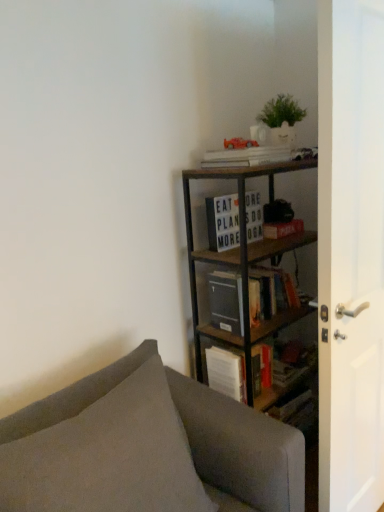
Describe the element at coordinates (352, 251) in the screenshot. I see `white glossy door at right` at that location.

Where is `white matte book at upper center, positioned as the 1th book in top-to-bottom order`? The width and height of the screenshot is (384, 512). white matte book at upper center, positioned as the 1th book in top-to-bottom order is located at coordinates (247, 156).

Is metallic brown bookcase at upper right located within white matte book at upper center, the 3th book when ordered from bottom to top?

That's incorrect, metallic brown bookcase at upper right is not inside white matte book at upper center, the 3th book when ordered from bottom to top.

From the image's perspective, does white matte book at upper center, positioned as the 1th book in top-to-bottom order, appear higher than metallic brown bookcase at upper right?

Yes, from the image's perspective, white matte book at upper center, positioned as the 1th book in top-to-bottom order, is above metallic brown bookcase at upper right.

Between white matte book at upper center, the 3th book when ordered from bottom to top, and metallic brown bookcase at upper right, which one appears on the right side from the viewer's perspective?

From the viewer's perspective, metallic brown bookcase at upper right appears more on the right side.

How distant is white matte book at upper center, positioned as the 1th book in top-to-bottom order, from metallic brown bookcase at upper right?

Result: white matte book at upper center, positioned as the 1th book in top-to-bottom order, and metallic brown bookcase at upper right are 13.87 inches apart.

Considering the positions of objects white matte paperback book at upper center and white matte signboard at upper center, the second book in the bottom-to-top sequence, in the image provided, who is more to the left, white matte paperback book at upper center or white matte signboard at upper center, the second book in the bottom-to-top sequence,?

Positioned to the left is white matte signboard at upper center, the second book in the bottom-to-top sequence.

Is white matte paperback book at upper center spatially inside white matte signboard at upper center, the second book in the bottom-to-top sequence, or outside of it?

white matte paperback book at upper center is not enclosed by white matte signboard at upper center, the second book in the bottom-to-top sequence.

Is white matte paperback book at upper center placed right next to white matte signboard at upper center, placed as the second book when sorted from top to bottom?

No, white matte paperback book at upper center is not next to white matte signboard at upper center, placed as the second book when sorted from top to bottom.

How much distance is there between white matte paperback book at upper center and white matte signboard at upper center, placed as the second book when sorted from top to bottom?

The distance of white matte paperback book at upper center from white matte signboard at upper center, placed as the second book when sorted from top to bottom, is 5.78 inches.

Which object is further away from the camera, white glossy door at right or metallic brown bookcase at upper right?

metallic brown bookcase at upper right.

Looking at this image, from a real-world perspective, relative to metallic brown bookcase at upper right, is white glossy door at right vertically above or below?

In terms of real-world spatial position, white glossy door at right is above metallic brown bookcase at upper right.

Based on the photo, is white glossy door at right bigger than metallic brown bookcase at upper right?

No, white glossy door at right is not bigger than metallic brown bookcase at upper right.

Which of these two, white matte signboard at upper center, the second book in the bottom-to-top sequence, or white matte paperback book at upper center, is smaller?

white matte paperback book at upper center.

Is there a large distance between white matte signboard at upper center, the second book in the bottom-to-top sequence, and white matte paperback book at upper center?

No, white matte signboard at upper center, the second book in the bottom-to-top sequence, is in close proximity to white matte paperback book at upper center.

Is white matte signboard at upper center, placed as the second book when sorted from top to bottom, oriented away from white matte paperback book at upper center?

No, white matte paperback book at upper center is not at the back of white matte signboard at upper center, placed as the second book when sorted from top to bottom.

Looking at their sizes, would you say white matte signboard at upper center, the second book in the bottom-to-top sequence, is wider or thinner than white matte paperback book at upper center?

In the image, white matte signboard at upper center, the second book in the bottom-to-top sequence, appears to be more narrow than white matte paperback book at upper center.

Looking at this image, from the image's perspective, which is below, white matte paperback book at upper center or white glossy door at right?

white glossy door at right.

From a real-world perspective, is white matte paperback book at upper center positioned under white glossy door at right based on gravity?

Incorrect, from a real-world perspective, white matte paperback book at upper center is higher than white glossy door at right.

Which point is more distant from viewer, [286,222] or [333,11]?

The point [286,222] is farther from the camera.

Could you tell me if white matte paperback book at upper center is facing white glossy door at right?

Yes, white matte paperback book at upper center is facing white glossy door at right.

From the image's perspective, is metallic brown bookcase at upper right on white glossy door at right?

No, from the image's perspective, metallic brown bookcase at upper right is not over white glossy door at right.

Would you say metallic brown bookcase at upper right is a long distance from white glossy door at right?

No, metallic brown bookcase at upper right is in close proximity to white glossy door at right.

How many degrees apart are the facing directions of metallic brown bookcase at upper right and white glossy door at right?

2.07 degrees separate the facing orientations of metallic brown bookcase at upper right and white glossy door at right.

Looking at this image, does metallic brown bookcase at upper right come in front of white glossy door at right?

No.

From the image's perspective, between white matte book at upper center, the 3th book when ordered from bottom to top, and white glossy door at right, who is located below?

white glossy door at right.

Considering the relative positions of white matte book at upper center, positioned as the 1th book in top-to-bottom order, and white glossy door at right in the image provided, is white matte book at upper center, positioned as the 1th book in top-to-bottom order, to the right of white glossy door at right from the viewer's perspective?

In fact, white matte book at upper center, positioned as the 1th book in top-to-bottom order, is to the left of white glossy door at right.

Which is nearer, (254, 161) or (369, 260)?

Point (254, 161) is farther from the camera than point (369, 260).

Is white matte book at upper center, the 3th book when ordered from bottom to top, in front of or behind white glossy door at right in the image?

In the image, white matte book at upper center, the 3th book when ordered from bottom to top, appears behind white glossy door at right.

This screenshot has width=384, height=512. In order to click on the 1st book behind the metallic brown bookcase at upper right in this screenshot , I will do `click(247, 156)`.

Where is `paperback book below the white matte signboard at upper center, placed as the second book when sorted from top to bottom (from a real-world perspective)`? Image resolution: width=384 pixels, height=512 pixels. paperback book below the white matte signboard at upper center, placed as the second book when sorted from top to bottom (from a real-world perspective) is located at coordinates (282, 229).

Based on their spatial positions, is matte black book at center, the third book when ordered from top to bottom, or white glossy door at right closer to gray fabric couch at lower left?

white glossy door at right is positioned closer to the anchor gray fabric couch at lower left.

Which object lies nearer to the anchor point white matte signboard at upper center, placed as the second book when sorted from top to bottom, matte black book at center, the third book when ordered from top to bottom, or metallic brown bookcase at upper right?

Based on the image, metallic brown bookcase at upper right appears to be nearer to white matte signboard at upper center, placed as the second book when sorted from top to bottom.

Looking at the image, which one is located further to metallic brown bookcase at upper right, matte black book at center, positioned as the 1th book in bottom-to-top order, or white matte signboard at upper center, the second book in the bottom-to-top sequence?

white matte signboard at upper center, the second book in the bottom-to-top sequence, is positioned further to the anchor metallic brown bookcase at upper right.

When comparing their distances from gray fabric couch at lower left, does white glossy door at right or white matte paperback book at upper center seem closer?

white glossy door at right is closer to gray fabric couch at lower left.

Considering their positions, is white glossy door at right positioned closer to white matte book at upper center, the 3th book when ordered from bottom to top, than matte black book at center, positioned as the 1th book in bottom-to-top order?

Based on the image, matte black book at center, positioned as the 1th book in bottom-to-top order, appears to be nearer to white matte book at upper center, the 3th book when ordered from bottom to top.

From the picture: Estimate the real-world distances between objects in this image. Which object is closer to gray fabric couch at lower left, white glossy door at right or white matte book at upper center, the 3th book when ordered from bottom to top?

white glossy door at right is closer to gray fabric couch at lower left.

Based on their spatial positions, is metallic brown bookcase at upper right or white matte paperback book at upper center further from matte black book at center, the third book when ordered from top to bottom?

white matte paperback book at upper center is further to matte black book at center, the third book when ordered from top to bottom.

Which object lies further to the anchor point white glossy door at right, metallic brown bookcase at upper right or matte black book at center, positioned as the 1th book in bottom-to-top order?

metallic brown bookcase at upper right is further to white glossy door at right.

Where is `bookcase between gray fabric couch at lower left and white glossy door at right in the horizontal direction`? This screenshot has width=384, height=512. bookcase between gray fabric couch at lower left and white glossy door at right in the horizontal direction is located at coordinates (242, 260).

The height and width of the screenshot is (512, 384). Find the location of `bookcase between white glossy door at right and white matte paperback book at upper center from front to back`. bookcase between white glossy door at right and white matte paperback book at upper center from front to back is located at coordinates (242, 260).

At what (x,y) coordinates should I click in order to perform the action: click on bookcase positioned between white glossy door at right and matte black book at center, positioned as the 1th book in bottom-to-top order, from near to far. Please return your answer as a coordinate pair (x, y). The image size is (384, 512). Looking at the image, I should click on pyautogui.click(x=242, y=260).

Where is `screen door between white matte book at upper center, the 3th book when ordered from bottom to top, and gray fabric couch at lower left, in the vertical direction`? The width and height of the screenshot is (384, 512). screen door between white matte book at upper center, the 3th book when ordered from bottom to top, and gray fabric couch at lower left, in the vertical direction is located at coordinates (352, 251).